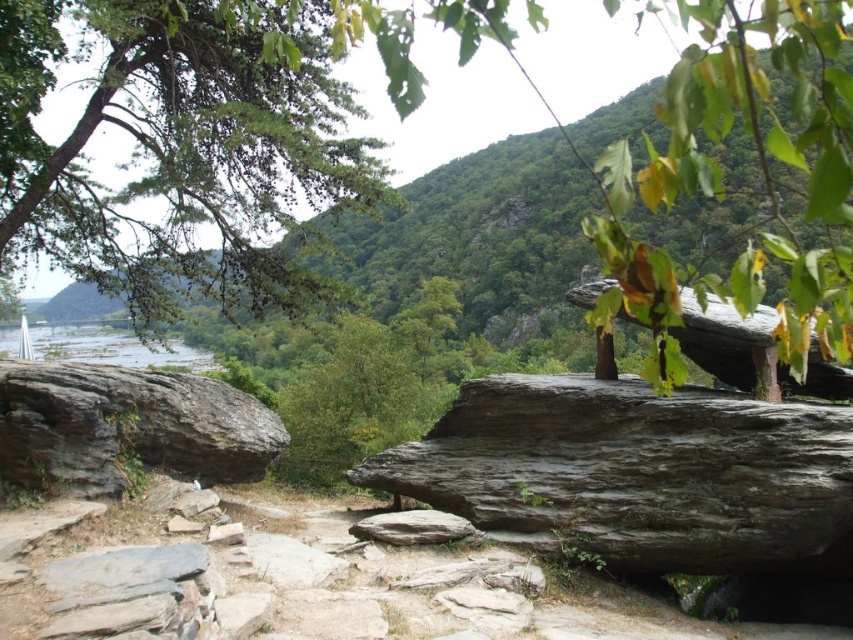
Question: Estimate the real-world distances between objects in this image. Which object is closer to the dark gray textured boulder at center?

Choices:
 (A) green matte tree at upper left
 (B) green leafy tree at upper center
 (C) clear blue water at upper left

Answer: (A)

Question: Which of the following is the farthest from the observer?

Choices:
 (A) gray rough boulder at left
 (B) green matte tree at upper left
 (C) dark gray textured boulder at center
 (D) clear blue water at upper left

Answer: (D)

Question: Which object is the farthest from the dark gray textured boulder at center?

Choices:
 (A) green matte tree at upper left
 (B) clear blue water at upper left

Answer: (B)

Question: Can you confirm if green leafy tree at upper center is positioned to the right of clear blue water at upper left?

Choices:
 (A) yes
 (B) no

Answer: (A)

Question: Is dark gray textured boulder at center wider than clear blue water at upper left?

Choices:
 (A) yes
 (B) no

Answer: (B)

Question: Where is green leafy tree at upper center located in relation to gray rough boulder at left in the image?

Choices:
 (A) below
 (B) above

Answer: (B)